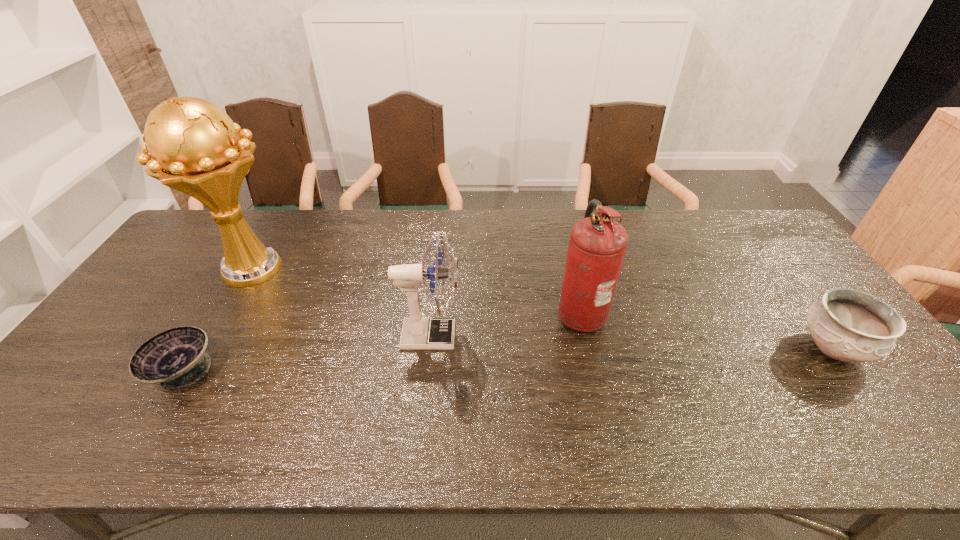
The width and height of the screenshot is (960, 540). In order to click on the tallest object in this screenshot , I will do `click(195, 146)`.

I want to click on the second tallest object, so click(597, 245).

In order to click on the fourth object from left to right in this screenshot , I will do `click(597, 245)`.

Locate an element on the screen. The width and height of the screenshot is (960, 540). the third object from left to right is located at coordinates (418, 333).

Where is `fan`? This screenshot has height=540, width=960. fan is located at coordinates (418, 333).

Identify the location of the second shortest object. The height and width of the screenshot is (540, 960). (846, 325).

At what (x,y) coordinates should I click in order to perform the action: click on pottery. Please return your answer as a coordinate pair (x, y). Looking at the image, I should click on coord(846,325).

Locate an element on the screen. bowl is located at coordinates (175, 358).

The width and height of the screenshot is (960, 540). What are the coordinates of `blank space located at the front of the tallest object where the globe is prominent` in the screenshot? It's located at (188, 378).

The height and width of the screenshot is (540, 960). Find the location of `blank space located at the front of the fourth object from left to right where the nozzle is aimed`. blank space located at the front of the fourth object from left to right where the nozzle is aimed is located at coordinates (496, 312).